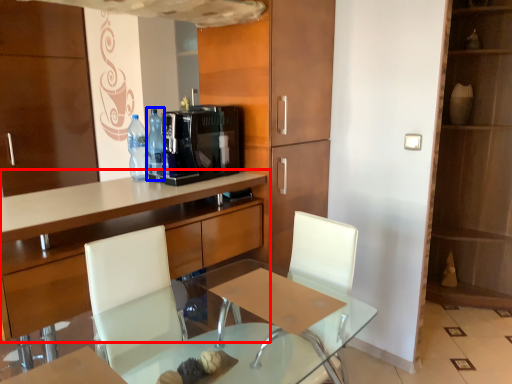
Question: Among these objects, which one is nearest to the camera, cabinetry (highlighted by a red box) or bottle (highlighted by a blue box)?

Choices:
 (A) cabinetry
 (B) bottle

Answer: (A)